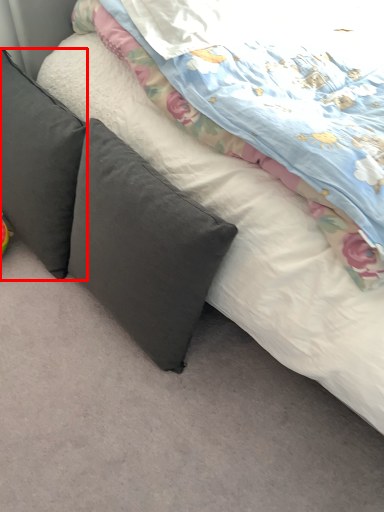
Question: From the image's perspective, what is the correct spatial relationship of pillow (annotated by the red box) in relation to pillow?

Choices:
 (A) above
 (B) below

Answer: (A)